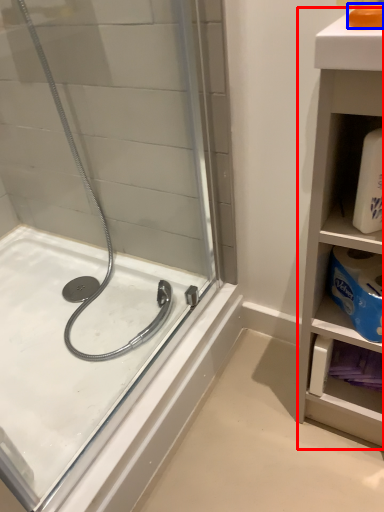
Question: Among these objects, which one is farthest to the camera, bathroom cabinet (highlighted by a red box) or soap (highlighted by a blue box)?

Choices:
 (A) bathroom cabinet
 (B) soap

Answer: (B)